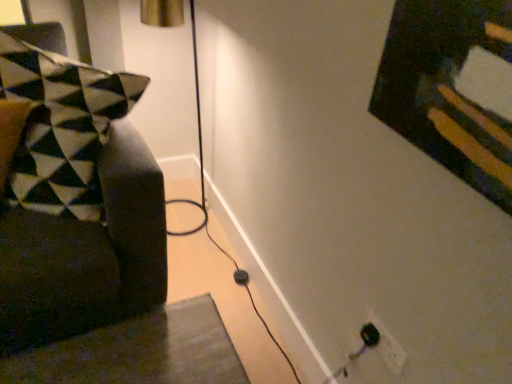
Question: Based on their sizes in the image, would you say black plastic electric outlet at lower right is bigger or smaller than velvet black pillow at left?

Choices:
 (A) small
 (B) big

Answer: (A)

Question: From a real-world perspective, relative to velvet black pillow at left, is black plastic electric outlet at lower right vertically above or below?

Choices:
 (A) above
 (B) below

Answer: (B)

Question: Is point (395, 340) closer or farther from the camera than point (130, 288)?

Choices:
 (A) closer
 (B) farther

Answer: (A)

Question: Based on their sizes in the image, would you say velvet black pillow at left is bigger or smaller than black plastic electric outlet at lower right?

Choices:
 (A) big
 (B) small

Answer: (A)

Question: Does point (50, 36) appear closer or farther from the camera than point (392, 345)?

Choices:
 (A) closer
 (B) farther

Answer: (B)

Question: Would you say velvet black pillow at left is inside or outside black plastic electric outlet at lower right?

Choices:
 (A) inside
 (B) outside

Answer: (B)

Question: From the image's perspective, relative to black plastic electric outlet at lower right, is velvet black pillow at left above or below?

Choices:
 (A) below
 (B) above

Answer: (B)